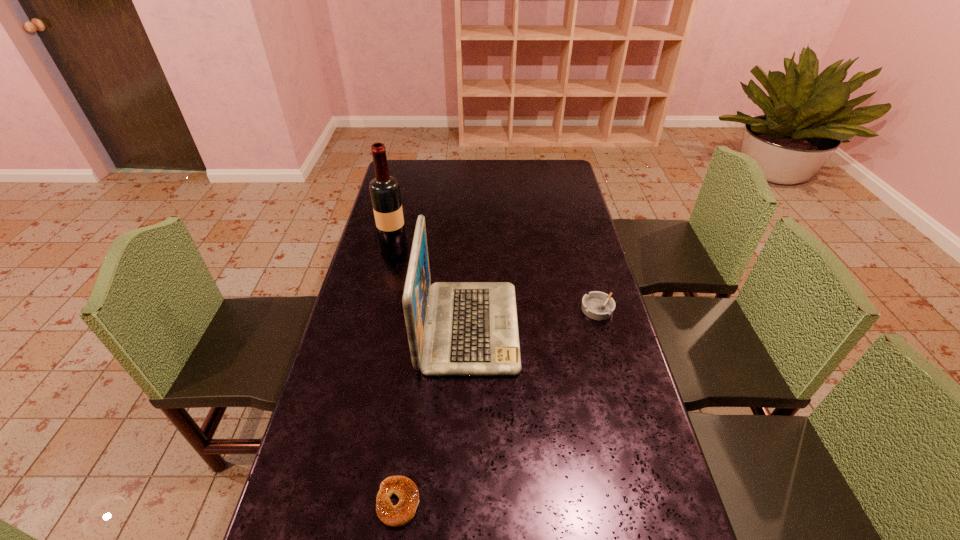
Locate an element on the screen. The height and width of the screenshot is (540, 960). free space between the ashtray and the laptop computer is located at coordinates (533, 318).

Identify the location of vacant space that is in between the third shortest object and the rightmost object. (533, 318).

The height and width of the screenshot is (540, 960). What are the coordinates of `free space between the laptop computer and the bagel` in the screenshot? It's located at (434, 415).

I want to click on the second closest object to the leftmost object, so click(x=597, y=305).

In order to click on object that is the second nearest to the farthest object in this screenshot , I will do `click(597, 305)`.